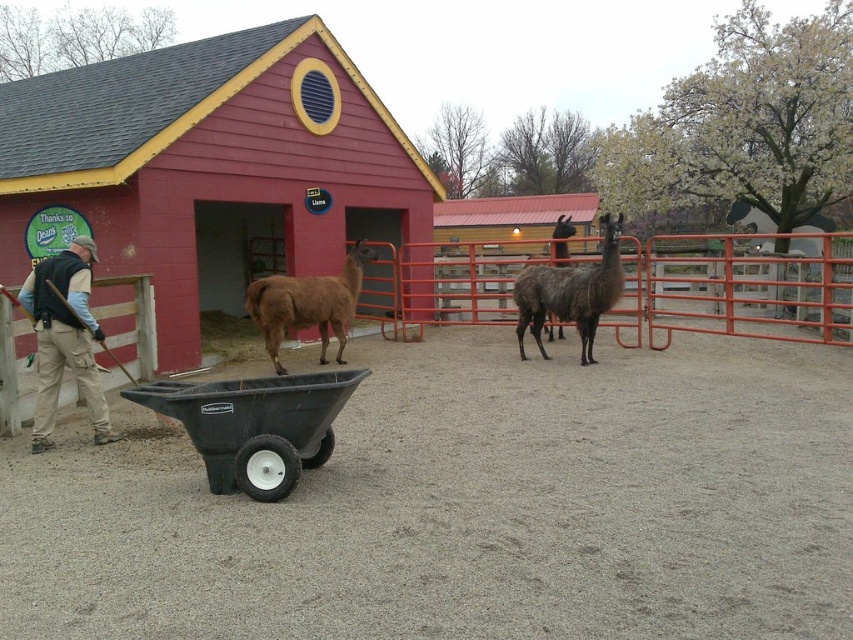
Question: Can you confirm if black rubber wheelbarrow at center is smaller than khaki pants at left?

Choices:
 (A) no
 (B) yes

Answer: (A)

Question: Does khaki pants at left have a larger size compared to brown woolly alpaca at center?

Choices:
 (A) yes
 (B) no

Answer: (B)

Question: Can you confirm if black rubber wheelbarrow at center is bigger than brown woolly alpaca at center?

Choices:
 (A) no
 (B) yes

Answer: (A)

Question: Which object appears farthest from the camera in this image?

Choices:
 (A) dark brown woolly alpaca at center
 (B) khaki pants at left
 (C) brown woolly alpaca at center

Answer: (C)

Question: Which is farther from the black rubber wheelbarrow at center?

Choices:
 (A) brown woolly alpaca at center
 (B) dark brown woolly alpaca at center

Answer: (B)

Question: Estimate the real-world distances between objects in this image. Which object is closer to the khaki pants at left?

Choices:
 (A) brown woolly alpaca at center
 (B) dark brown woolly alpaca at center
 (C) black rubber wheelbarrow at center

Answer: (C)